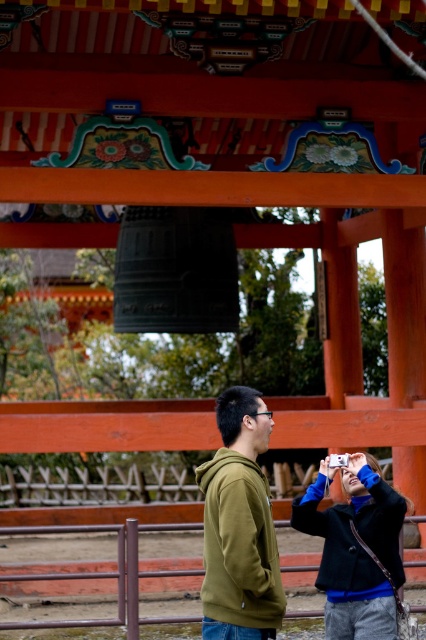
You are standing at the torii gate and notice the green matte hoodie at center. Can you determine its exact location using the coordinate system provided?

The green matte hoodie at center is located at point (239, 525).

You are a photographer trying to capture a photo of both the green matte hoodie at center and the dark blue textured jacket at lower right in the scene. Which one would you need to zoom in more on to ensure it appears clear in the photo?

The green matte hoodie at center is larger in size than the dark blue textured jacket at lower right, so you would need to zoom in more on the dark blue textured jacket at lower right to ensure it appears clear in the photo.